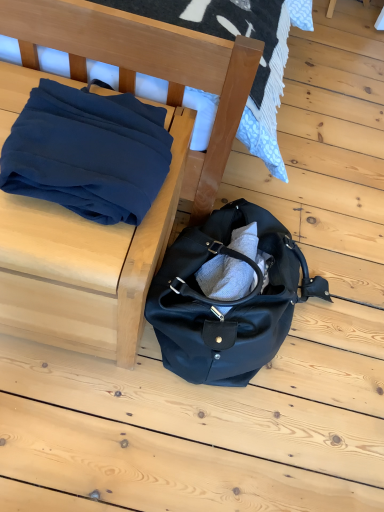
Question: From the image's perspective, does matte blue fabric at left appear lower than matte black duffel bag at lower center?

Choices:
 (A) no
 (B) yes

Answer: (A)

Question: Is matte blue fabric at left further to camera compared to matte black duffel bag at lower center?

Choices:
 (A) yes
 (B) no

Answer: (B)

Question: Is matte blue fabric at left smaller than matte black duffel bag at lower center?

Choices:
 (A) yes
 (B) no

Answer: (B)

Question: Is matte blue fabric at left directly adjacent to matte black duffel bag at lower center?

Choices:
 (A) no
 (B) yes

Answer: (A)

Question: Does matte blue fabric at left have a greater width compared to matte black duffel bag at lower center?

Choices:
 (A) yes
 (B) no

Answer: (B)

Question: Is matte blue fabric at left facing away from matte black duffel bag at lower center?

Choices:
 (A) no
 (B) yes

Answer: (A)

Question: From the image's perspective, is navy blue fabric at upper left beneath matte blue fabric at left?

Choices:
 (A) yes
 (B) no

Answer: (B)

Question: Is navy blue fabric at upper left wider than matte blue fabric at left?

Choices:
 (A) yes
 (B) no

Answer: (B)

Question: From a real-world perspective, is navy blue fabric at upper left positioned over matte blue fabric at left based on gravity?

Choices:
 (A) no
 (B) yes

Answer: (B)

Question: Is navy blue fabric at upper left touching matte blue fabric at left?

Choices:
 (A) yes
 (B) no

Answer: (B)

Question: Are navy blue fabric at upper left and matte blue fabric at left located far from each other?

Choices:
 (A) yes
 (B) no

Answer: (B)

Question: Is matte blue fabric at left located within navy blue fabric at upper left?

Choices:
 (A) no
 (B) yes

Answer: (A)

Question: Is navy blue fabric at upper left further to the viewer compared to matte black duffel bag at lower center?

Choices:
 (A) no
 (B) yes

Answer: (A)